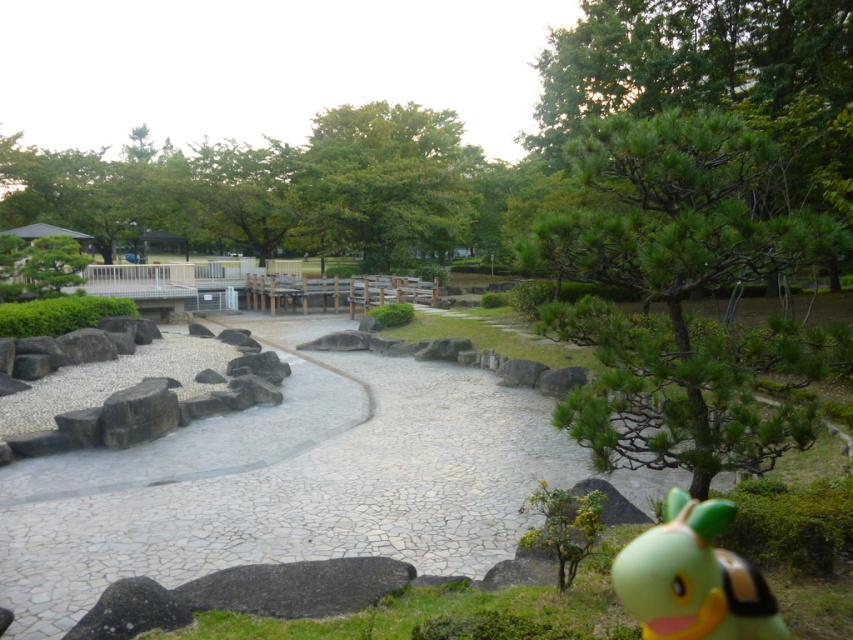
Is green textured tree at upper right below green leafy tree at upper center?

Indeed, green textured tree at upper right is positioned under green leafy tree at upper center.

Consider the image. Is green textured tree at upper right behind green leafy tree at upper center?

No, it is not.

Identify the location of green textured tree at upper right. Image resolution: width=853 pixels, height=640 pixels. (680, 294).

Does white stone path at center lie behind green textured tree at upper right?

Yes, it is.

Does white stone path at center have a greater height compared to green textured tree at upper right?

Indeed, white stone path at center has a greater height compared to green textured tree at upper right.

Between point (456, 476) and point (827, 225), which one is positioned in front?

Point (827, 225) is more forward.

Locate an element on the screen. This screenshot has width=853, height=640. white stone path at center is located at coordinates (287, 481).

Can you confirm if white stone path at center is wider than green leafy tree at upper center?

No, white stone path at center is not wider than green leafy tree at upper center.

This screenshot has height=640, width=853. I want to click on white stone path at center, so click(x=287, y=481).